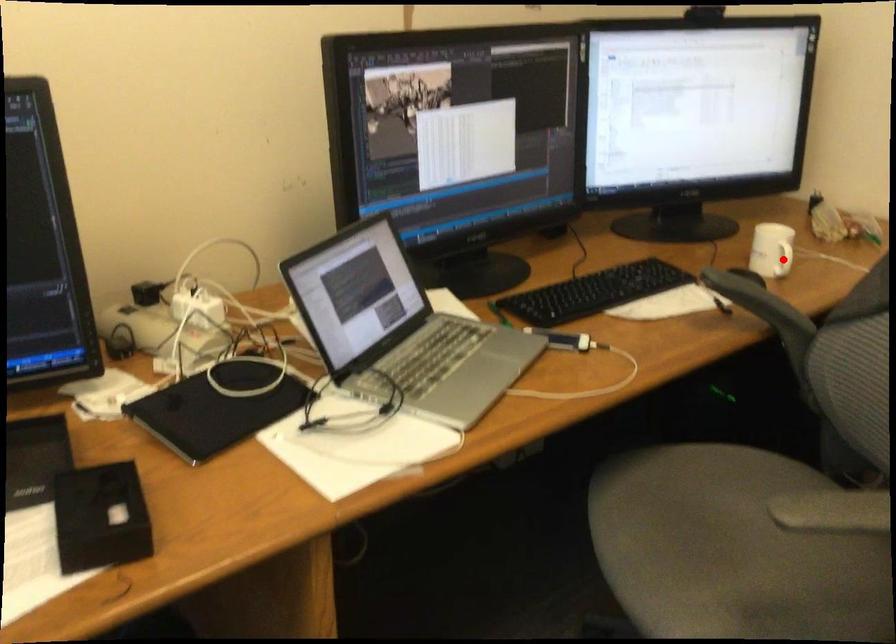
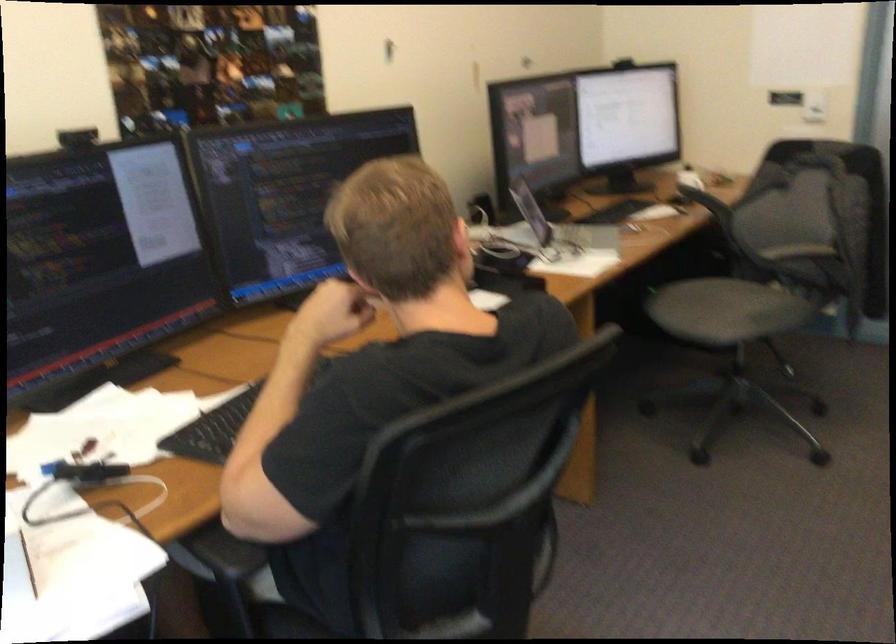
Question: I am providing you with two images of the same scene from different viewpoints. A red point is marked on the first image. At the location where the point appears in image 1, is it still visible in image 2?

Choices:
 (A) Yes
 (B) No

Answer: (B)